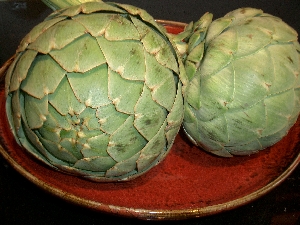
Locate an element on the screen. The image size is (300, 225). dark brown table is located at coordinates (36, 209).